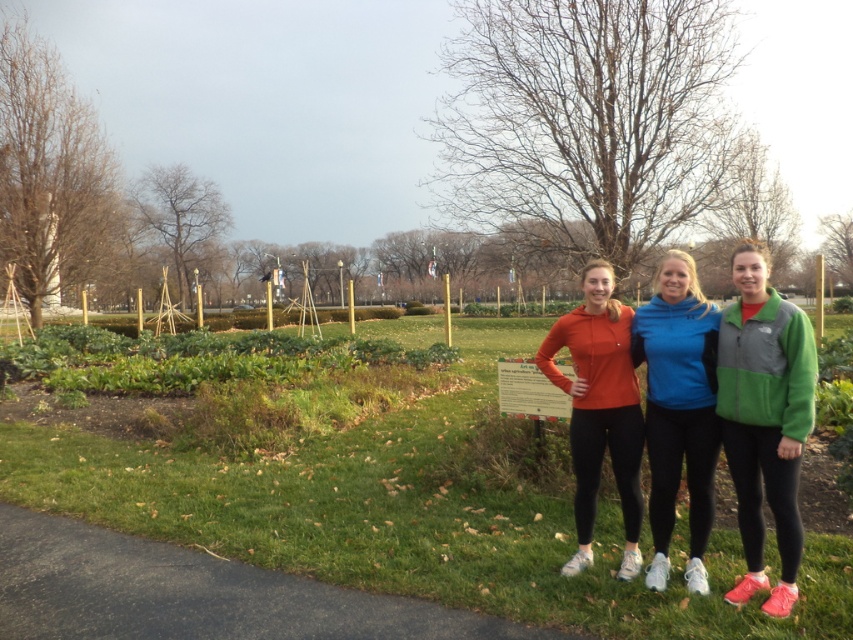
Question: Which of these objects is positioned farthest from the blue fleece jacket at center?

Choices:
 (A) black asphalt path at lower left
 (B) green grass at center
 (C) green fleece jacket at right

Answer: (B)

Question: Is green grass at center to the left of blue fleece jacket at center from the viewer's perspective?

Choices:
 (A) yes
 (B) no

Answer: (A)

Question: Can you confirm if black asphalt path at lower left is positioned below matte orange hoodie at center?

Choices:
 (A) no
 (B) yes

Answer: (B)

Question: Can you confirm if black asphalt path at lower left is bigger than matte orange hoodie at center?

Choices:
 (A) yes
 (B) no

Answer: (B)

Question: Among these points, which one is nearest to the camera?

Choices:
 (A) (590, 355)
 (B) (184, 476)

Answer: (A)

Question: Which of the following is the farthest from the observer?

Choices:
 (A) (242, 616)
 (B) (596, 438)
 (C) (813, 394)
 (D) (700, 468)

Answer: (B)